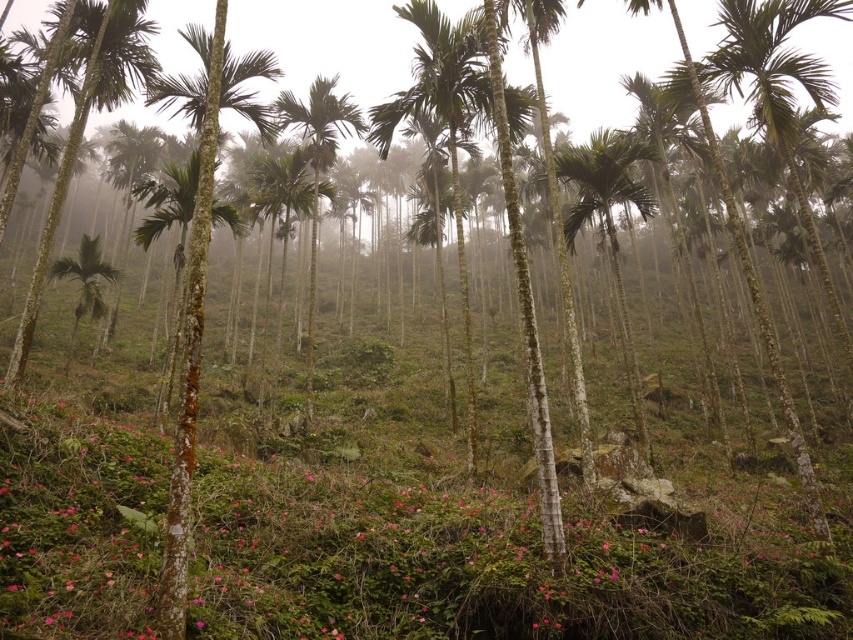
Question: Among these points, which one is farthest from the camera?

Choices:
 (A) coord(329,134)
 (B) coord(67,140)
 (C) coord(576,221)
 (D) coord(155,531)

Answer: (B)

Question: Is pink matte flower at center above green leafy palm tree at center?

Choices:
 (A) yes
 (B) no

Answer: (B)

Question: Can you confirm if pink matte flower at center is positioned below green glossy palm tree at left?

Choices:
 (A) yes
 (B) no

Answer: (A)

Question: In this image, where is pink matte flower at center located relative to green glossy palm tree at left?

Choices:
 (A) below
 (B) above

Answer: (A)

Question: Among these objects, which one is farthest from the camera?

Choices:
 (A) pink matte flower at center
 (B) green smooth palm tree at center
 (C) green smooth palm tree at left
 (D) green leafy palm tree at center

Answer: (B)

Question: Which of the following is the closest to the observer?

Choices:
 (A) green smooth palm tree at center
 (B) green glossy palm tree at left
 (C) pink matte flower at center

Answer: (C)